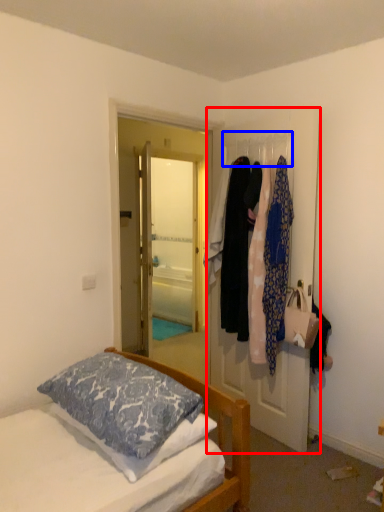
Question: Which object appears farthest to the camera in this image, door (highlighted by a red box) or clothesline (highlighted by a blue box)?

Choices:
 (A) door
 (B) clothesline

Answer: (B)